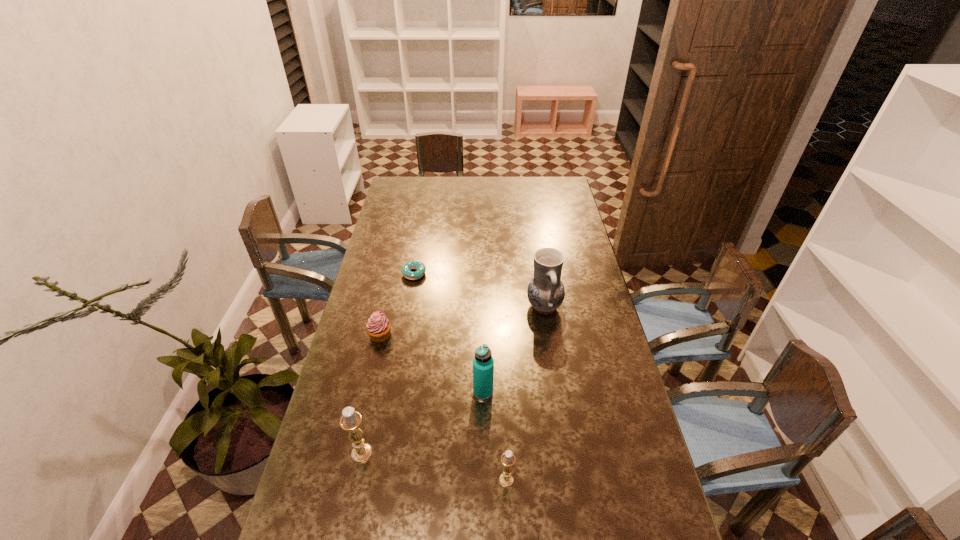
Identify the location of blank area in the image that satisfies the following two spatial constraints: 1. on the front side of the shorter candle holder; 2. on the left side of the taller candle holder. (356, 480).

Locate an element on the screen. This screenshot has height=540, width=960. vacant area that satisfies the following two spatial constraints: 1. on the back side of the left candle holder; 2. on the left side of the water bottle is located at coordinates (374, 392).

Locate an element on the screen. Image resolution: width=960 pixels, height=540 pixels. vacant position in the image that satisfies the following two spatial constraints: 1. on the back side of the rightmost object; 2. on the left side of the fourth nearest object is located at coordinates (387, 307).

I want to click on vacant point that satisfies the following two spatial constraints: 1. on the back side of the rightmost object; 2. on the left side of the water bottle, so click(x=483, y=307).

This screenshot has height=540, width=960. Identify the location of vacant space that satisfies the following two spatial constraints: 1. on the back side of the second shortest object; 2. on the left side of the doughnut. (394, 274).

I want to click on vacant area in the image that satisfies the following two spatial constraints: 1. on the back side of the farthest object; 2. on the left side of the left candle holder, so click(399, 274).